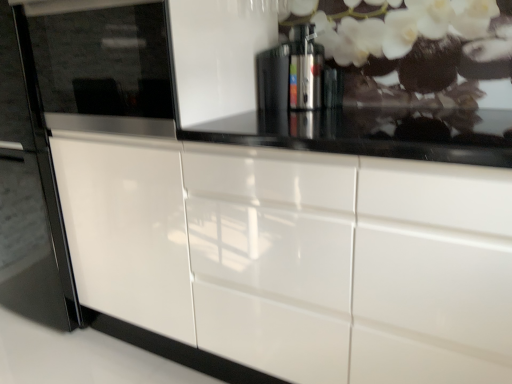
What do you see at coordinates (91, 85) in the screenshot? I see `glossy white fridge at left` at bounding box center [91, 85].

Where is `glossy white fridge at left`? glossy white fridge at left is located at coordinates (91, 85).

Considering the points (292, 53) and (419, 333), which point is in front, point (292, 53) or point (419, 333)?

Point (419, 333)

Could glossy white cabinet at center be considered to be inside satin silver coffee machine at center?

No, glossy white cabinet at center is not surrounded by satin silver coffee machine at center.

Is satin silver coffee machine at center facing away from glossy white cabinet at center?

No.

Is satin silver coffee machine at center closer to camera compared to glossy white cabinet at center?

No, it is behind glossy white cabinet at center.

Can you confirm if glossy white fridge at left is wider than glossy white cabinet at center?

No.

Is glossy white fridge at left positioned far away from glossy white cabinet at center?

No.

Does point (144, 124) appear closer or farther from the camera than point (196, 224)?

Clearly, point (144, 124) is closer to the camera than point (196, 224).

Is glossy white cabinet at center at the back of glossy white fridge at left?

glossy white fridge at left is not turned away from glossy white cabinet at center.

In the scene shown: Which is more to the left, glossy white cabinet at center or glossy black microwave at left?

glossy black microwave at left.

From the image's perspective, who appears lower, glossy white cabinet at center or glossy black microwave at left?

glossy white cabinet at center is shown below in the image.

From a real-world perspective, which object rests below the other?

glossy white fridge at left.

How different are the orientations of satin silver coffee machine at center and glossy white fridge at left in degrees?

satin silver coffee machine at center and glossy white fridge at left are facing 0.444 degrees away from each other.

Considering the sizes of satin silver coffee machine at center and glossy white fridge at left in the image, is satin silver coffee machine at center taller or shorter than glossy white fridge at left?

satin silver coffee machine at center is shorter than glossy white fridge at left.

Is satin silver coffee machine at center in contact with glossy white fridge at left?

No, satin silver coffee machine at center is not beside glossy white fridge at left.

Can you tell me how much glossy black microwave at left and glossy white cabinet at center differ in facing direction?

1.5 degrees.

Which of these two, glossy black microwave at left or glossy white cabinet at center, stands shorter?

glossy black microwave at left is shorter.

Which object is more forward, glossy black microwave at left or glossy white cabinet at center?

Positioned in front is glossy white cabinet at center.

Who is bigger, glossy black microwave at left or glossy white cabinet at center?

glossy white cabinet at center.

Considering the positions of objects glossy white cabinet at center and glossy white fridge at left in the image provided, who is more to the left, glossy white cabinet at center or glossy white fridge at left?

glossy white fridge at left.

Which is behind, point (406, 265) or point (131, 71)?

The point (131, 71) is farther.

Are glossy white cabinet at center and glossy white fridge at left located far from each other?

No.

Considering the relative sizes of glossy white fridge at left and satin silver coffee machine at center in the image provided, is glossy white fridge at left taller than satin silver coffee machine at center?

Yes.

Which object is positioned more to the left, glossy white fridge at left or satin silver coffee machine at center?

glossy white fridge at left is more to the left.

Considering the positions of objects glossy white fridge at left and satin silver coffee machine at center in the image provided, who is behind, glossy white fridge at left or satin silver coffee machine at center?

satin silver coffee machine at center is more distant.

Consider the image. Which of these two, glossy white fridge at left or satin silver coffee machine at center, is smaller?

satin silver coffee machine at center is smaller.

The height and width of the screenshot is (384, 512). Find the location of `cabinetry below the satin silver coffee machine at center (from the image's perspective)`. cabinetry below the satin silver coffee machine at center (from the image's perspective) is located at coordinates (295, 256).

I want to click on cabinetry below the glossy white fridge at left (from a real-world perspective), so click(295, 256).

When comparing their distances from glossy black microwave at left, does satin silver coffee machine at center or glossy white fridge at left seem closer?

The object closer to glossy black microwave at left is glossy white fridge at left.

Which object lies further to the anchor point satin silver coffee machine at center, glossy white fridge at left or glossy white cabinet at center?

Among the two, glossy white cabinet at center is located further to satin silver coffee machine at center.

Estimate the real-world distances between objects in this image. Which object is closer to glossy black microwave at left, satin silver coffee machine at center or glossy white cabinet at center?

glossy white cabinet at center lies closer to glossy black microwave at left than the other object.

Estimate the real-world distances between objects in this image. Which object is closer to glossy black microwave at left, glossy white fridge at left or glossy white cabinet at center?

glossy white fridge at left is closer to glossy black microwave at left.

When comparing their distances from satin silver coffee machine at center, does glossy white fridge at left or glossy black microwave at left seem closer?

glossy black microwave at left is positioned closer to the anchor satin silver coffee machine at center.

From the picture: Considering their positions, is glossy black microwave at left positioned closer to satin silver coffee machine at center than glossy white fridge at left?

glossy black microwave at left is closer to satin silver coffee machine at center.

From the image, which object appears to be nearer to glossy white cabinet at center, satin silver coffee machine at center or glossy white fridge at left?

glossy white fridge at left.

Estimate the real-world distances between objects in this image. Which object is further from satin silver coffee machine at center, glossy black microwave at left or glossy white cabinet at center?

glossy white cabinet at center is positioned further to the anchor satin silver coffee machine at center.

Locate an element on the screen. appliance located between glossy white fridge at left and glossy white cabinet at center in the left-right direction is located at coordinates 103,64.

Identify the location of coffee machine between glossy black microwave at left and glossy white cabinet at center in the horizontal direction. (297, 75).

This screenshot has height=384, width=512. Find the location of `coffee machine between glossy white fridge at left and glossy white cabinet at center from left to right`. coffee machine between glossy white fridge at left and glossy white cabinet at center from left to right is located at coordinates (297, 75).

Locate an element on the screen. The image size is (512, 384). appliance between glossy white fridge at left and satin silver coffee machine at center in the horizontal direction is located at coordinates (103, 64).